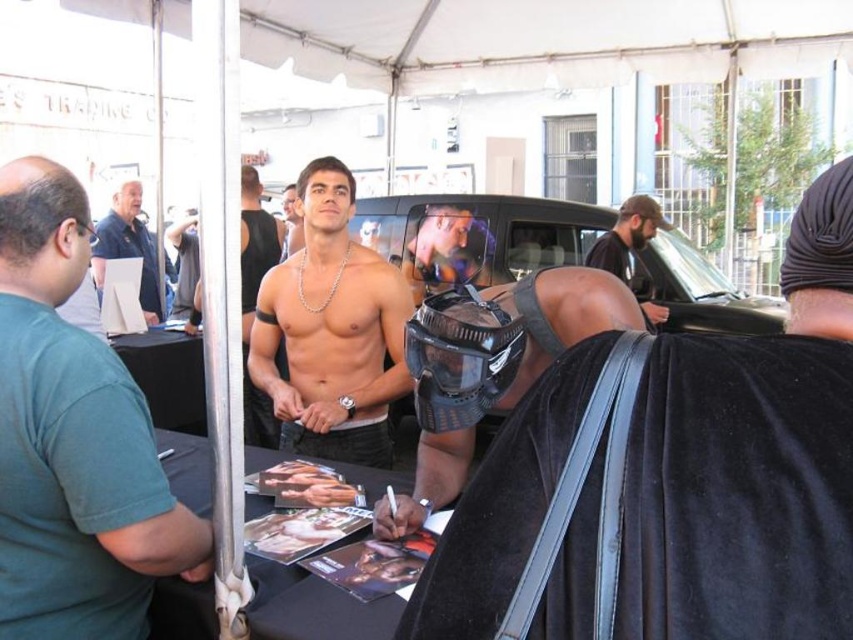
Question: Can you confirm if black matte mask at center is bigger than green t-shirt at left?

Choices:
 (A) yes
 (B) no

Answer: (A)

Question: Which point is closer to the camera?

Choices:
 (A) (476, 227)
 (B) (834, 200)

Answer: (B)

Question: Which point is closer to the camera taking this photo?

Choices:
 (A) (456, 266)
 (B) (293, 221)
 (C) (155, 308)
 (D) (445, 397)

Answer: (D)

Question: Which of the following is the closest to the observer?

Choices:
 (A) shiny silver chain at center
 (B) black matte helmet at center
 (C) blue shirt at upper left

Answer: (B)

Question: Can you confirm if shiny metallic helmet at center is wider than bearded man at center?

Choices:
 (A) yes
 (B) no

Answer: (B)

Question: From the image, what is the correct spatial relationship of black matte helmet at center in relation to blue shirt at upper left?

Choices:
 (A) above
 (B) below

Answer: (B)